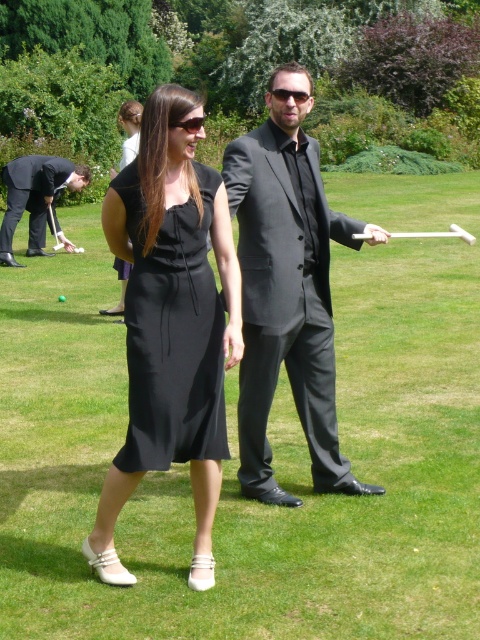
Does black satin dress at center have a lesser height compared to matte black suit at center?

Incorrect, black satin dress at center's height does not fall short of matte black suit at center's.

Which is behind, point (231, 337) or point (283, 80)?

The point (283, 80) is more distant.

Find the location of a particular element. black satin dress at center is located at coordinates (170, 323).

Which is below, black satin dress at center or black suit at left?

black satin dress at center is below.

Does black satin dress at center appear on the right side of black suit at left?

Correct, you'll find black satin dress at center to the right of black suit at left.

Who is more forward, (186,420) or (46,205)?

Positioned in front is point (186,420).

The height and width of the screenshot is (640, 480). I want to click on black satin dress at center, so click(170, 323).

The width and height of the screenshot is (480, 640). What do you see at coordinates (172, 333) in the screenshot?
I see `satin black dress at center` at bounding box center [172, 333].

Is point (192, 244) closer to camera compared to point (0, 250)?

That is True.

Consider the image. Measure the distance between satin black dress at center and camera.

satin black dress at center is 3.76 meters from camera.

Where is `satin black dress at center`? This screenshot has height=640, width=480. satin black dress at center is located at coordinates (172, 333).